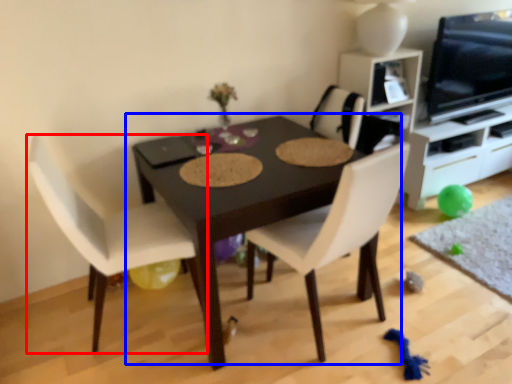
Question: Which object is further to the camera taking this photo, chair (highlighted by a red box) or table (highlighted by a blue box)?

Choices:
 (A) chair
 (B) table

Answer: (B)